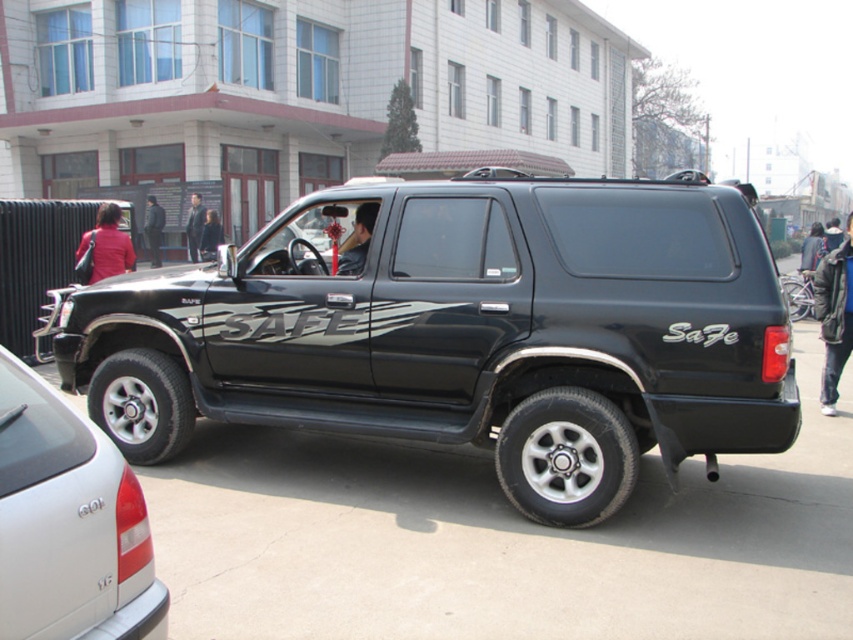
Question: Does matte black suv at center appear on the left side of glossy black suv at center?

Choices:
 (A) no
 (B) yes

Answer: (A)

Question: Can you confirm if matte black suv at center is positioned to the right of glossy black suv at center?

Choices:
 (A) yes
 (B) no

Answer: (A)

Question: Can you confirm if matte black suv at center is positioned to the right of glossy black suv at center?

Choices:
 (A) yes
 (B) no

Answer: (A)